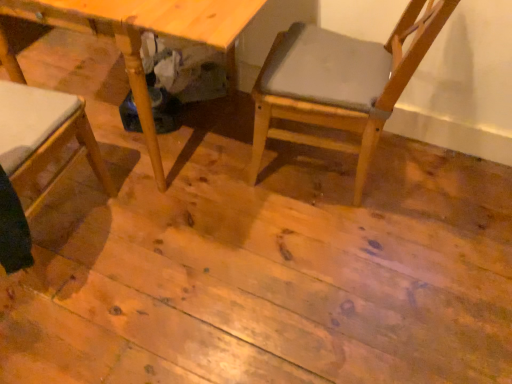
The image size is (512, 384). I want to click on light brown wood chair at center, so click(x=340, y=83).

The width and height of the screenshot is (512, 384). What do you see at coordinates (340, 83) in the screenshot?
I see `light brown wood chair at center` at bounding box center [340, 83].

The height and width of the screenshot is (384, 512). Describe the element at coordinates (140, 32) in the screenshot. I see `natural wood table at center` at that location.

Image resolution: width=512 pixels, height=384 pixels. What are the coordinates of `natural wood table at center` in the screenshot? It's located at (140, 32).

Where is `light brown wood chair at center`? Image resolution: width=512 pixels, height=384 pixels. light brown wood chair at center is located at coordinates (340, 83).

Which is more to the left, natural wood table at center or light brown wood chair at center?

natural wood table at center is more to the left.

Which object is further away from the camera, natural wood table at center or light brown wood chair at center?

natural wood table at center is behind.

Which is closer, (x=42, y=6) or (x=304, y=48)?

Point (x=42, y=6) is closer to the camera than point (x=304, y=48).

From the image's perspective, is natural wood table at center below light brown wood chair at center?

Actually, natural wood table at center appears above light brown wood chair at center in the image.

Consider the image. From a real-world perspective, is natural wood table at center over light brown wood chair at center?

No, from a real-world perspective, natural wood table at center is not over light brown wood chair at center

Does natural wood table at center have a lesser width compared to light brown wood chair at center?

No.

From their relative heights in the image, would you say natural wood table at center is taller or shorter than light brown wood chair at center?

In the image, natural wood table at center appears to be shorter than light brown wood chair at center.

Based on the photo, is natural wood table at center smaller than light brown wood chair at center?

Incorrect, natural wood table at center is not smaller in size than light brown wood chair at center.

Would you say natural wood table at center is inside or outside light brown wood chair at center?

natural wood table at center is located beyond the bounds of light brown wood chair at center.

Are natural wood table at center and light brown wood chair at center located far from each other?

That's not correct — natural wood table at center is a little close to light brown wood chair at center.

Is natural wood table at center looking in the opposite direction of light brown wood chair at center?

No, light brown wood chair at center is not at the back of natural wood table at center.

Where is `chair below the natural wood table at center (from the image's perspective)`? The image size is (512, 384). chair below the natural wood table at center (from the image's perspective) is located at coordinates (340, 83).

Which is more to the left, light brown wood chair at center or natural wood table at center?

From the viewer's perspective, natural wood table at center appears more on the left side.

Between light brown wood chair at center and natural wood table at center, which one is positioned in front?

Positioned in front is light brown wood chair at center.

Which is farther from the camera, (339, 106) or (247, 22)?

The point (339, 106) is farther from the camera.

From the image's perspective, between light brown wood chair at center and natural wood table at center, who is located below?

light brown wood chair at center appears lower in the image.

From a real-world perspective, which is physically below, light brown wood chair at center or natural wood table at center?

In real-world perspective, natural wood table at center is lower.

Which of these two, light brown wood chair at center or natural wood table at center, is thinner?

Thinner between the two is light brown wood chair at center.

Does light brown wood chair at center have a lesser height compared to natural wood table at center?

In fact, light brown wood chair at center may be taller than natural wood table at center.

Can you confirm if light brown wood chair at center is bigger than natural wood table at center?

Incorrect, light brown wood chair at center is not larger than natural wood table at center.

Is light brown wood chair at center surrounding natural wood table at center?

No, natural wood table at center is located outside of light brown wood chair at center.

Is there a large distance between light brown wood chair at center and natural wood table at center?

light brown wood chair at center is near natural wood table at center, not far away.

Is light brown wood chair at center oriented away from natural wood table at center?

light brown wood chair at center is not turned away from natural wood table at center.

Measure the distance from light brown wood chair at center to natural wood table at center.

light brown wood chair at center and natural wood table at center are 18.46 inches apart from each other.

Locate an element on the screen. The image size is (512, 384). chair positioned vertically above the natural wood table at center (from a real-world perspective) is located at coordinates (340, 83).

At what (x,y) coordinates should I click in order to perform the action: click on chair in front of the natural wood table at center. Please return your answer as a coordinate pair (x, y). The image size is (512, 384). Looking at the image, I should click on (340, 83).

Locate an element on the screen. table located on the left of light brown wood chair at center is located at coordinates (140, 32).